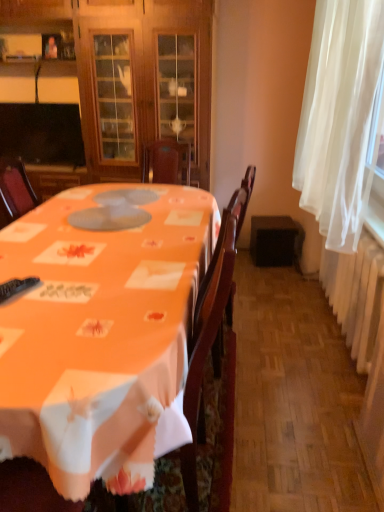
You are a GUI agent. You are given a task and a screenshot of the screen. Output one action in this format:
    pyautogui.click(x=<x>, y=<y>)
    Task: Click on the empty space that is ontop of orange fabric table at center (from a real-world perspective)
    
    Given the screenshot: What is the action you would take?
    pyautogui.click(x=82, y=227)